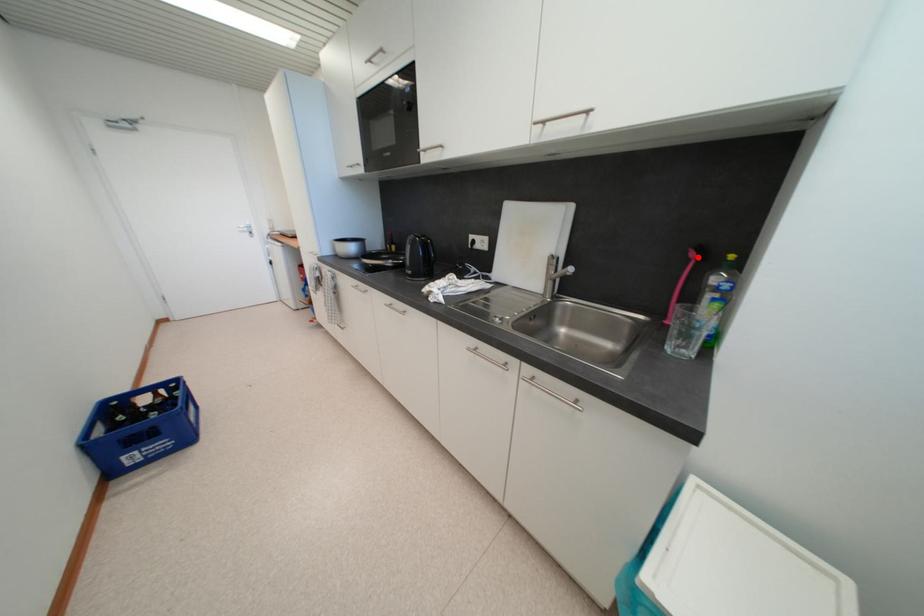
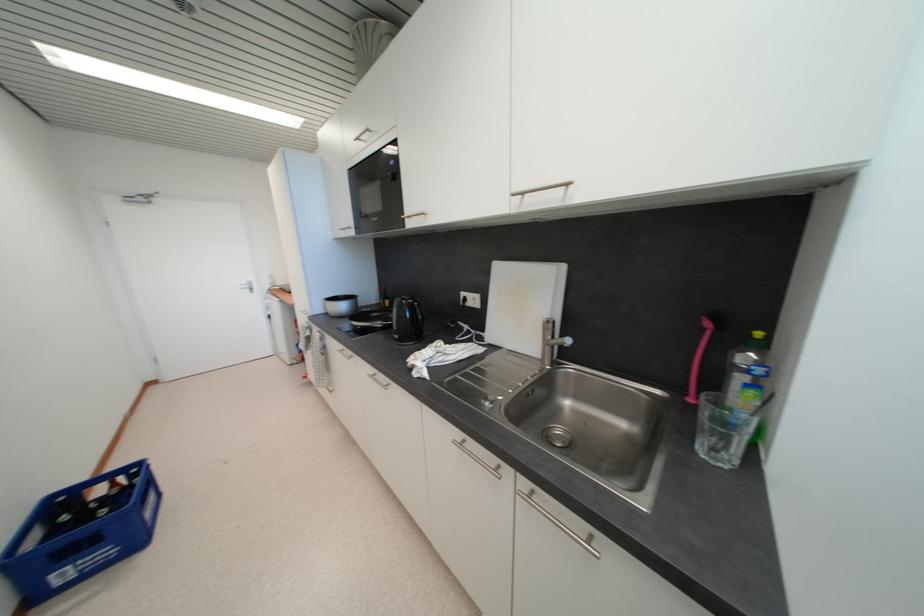
In the second image, find the point that corresponds to the highlighted location in the first image.

(713, 326)